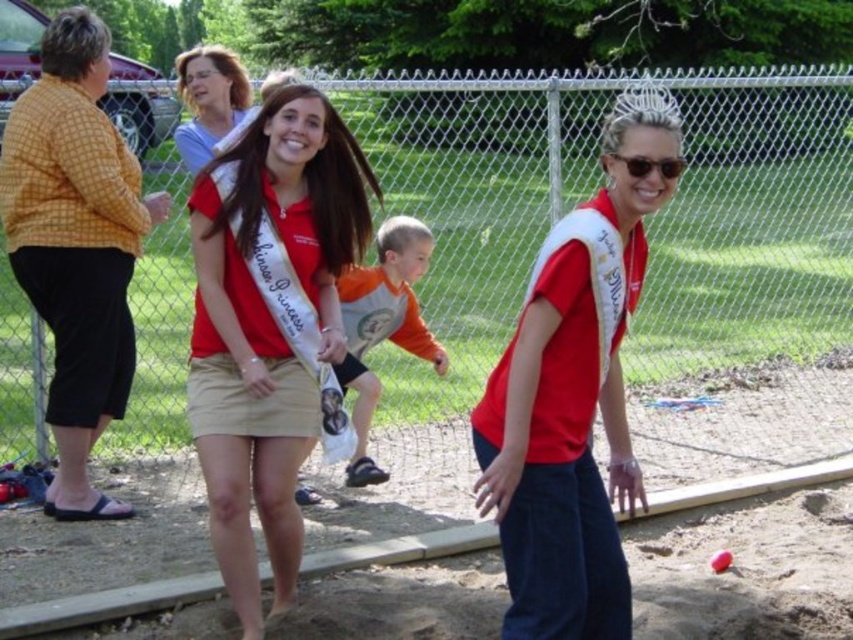
You are taking a photo of the two points in the image. Which point, point (543, 627) or point (393, 237), will appear larger in your photo?

Point (543, 627) is closer to the camera than point (393, 237), so it will appear larger in the photo.

You are standing in the middle of the fenced area at the community event. You notice two points marked in the scene. Which point is closer to you, point (607, 132) or point (256, 616)?

Point (607, 132) is closer to the viewer than point (256, 616).